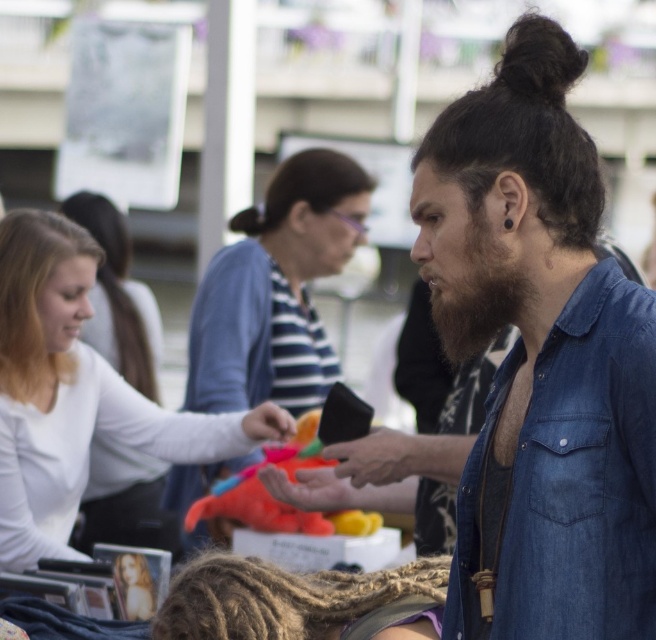
You are standing at the market and want to take a photo of both the man with the beard and the woman in the striped shirt. Which of the two points, point (x=72, y=374) or point (x=268, y=634), should you focus on to ensure both subjects are in clear view?

You should focus on point (x=72, y=374) because it is closer to the camera than point (x=268, y=634), ensuring both subjects are in focus.

You are a photographer standing at the center of the market. You want to take a photo that includes both the blonde hair at left and the dark brown hair at upper center. What is the minimum distance you need to move backward to ensure both subjects are in frame?

The minimum distance you need to move backward to include both the blonde hair at left and the dark brown hair at upper center is 4.50 feet.

You are standing at the center of the market and see the point marked at coordinates (295, 600). What is located at that point?

The point at (295, 600) marks dreadlocks at center.